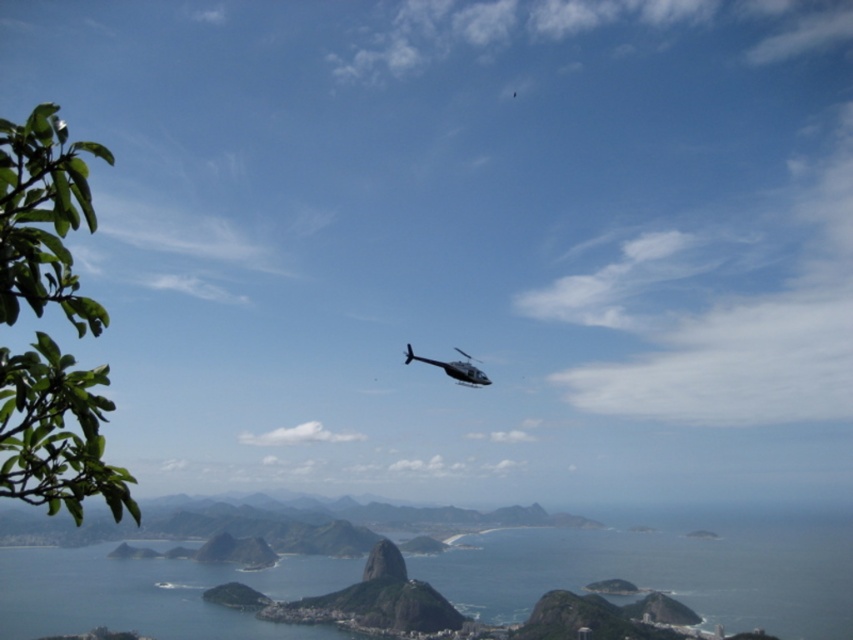
Who is positioned more to the left, blue water at center or metallic silver helicopter at center?

From the viewer's perspective, blue water at center appears more on the left side.

Is point (758, 612) farther from viewer compared to point (460, 372)?

That is True.

Where is `blue water at center`? This screenshot has height=640, width=853. blue water at center is located at coordinates pos(664,572).